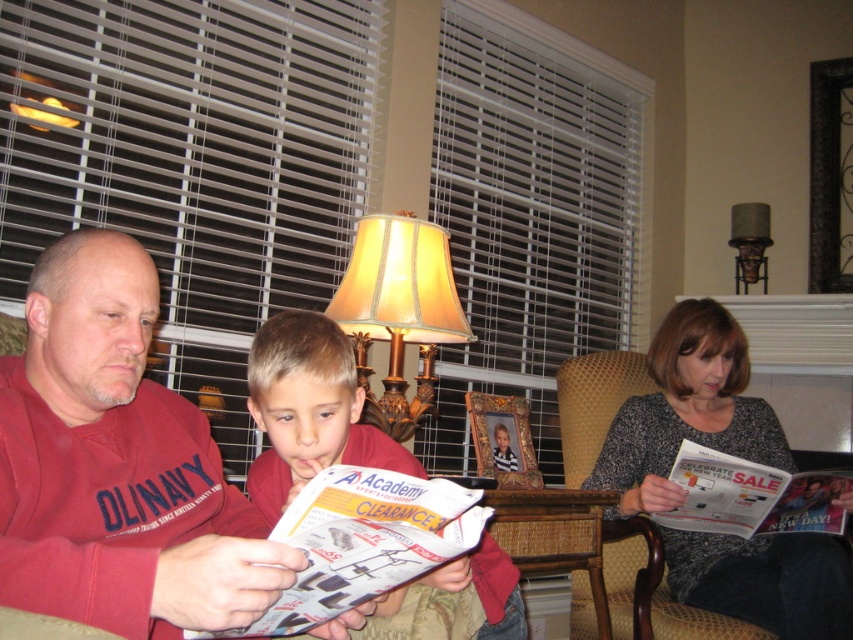
You are a photographer setting up a shot in this living room. You need to position a camera so that both the matte beige lampshade at center and the matte paper magazine at lower right are visible in the frame. Considering their heights, which object will appear taller in the photo?

The matte beige lampshade at center will appear taller in the photo because it has a greater height compared to the matte paper magazine at lower right.

You are a photographer trying to capture a clear shot of the white glossy magazine at center without the speckled gray sweater at center blocking it. Which object should you move closer to the camera to achieve this?

To capture a clear shot of the white glossy magazine at center without the speckled gray sweater at center blocking it, you should move the white glossy magazine at center closer to the camera. Since the speckled gray sweater at center is currently further away from the viewer, moving the magazine forward would place it in front of the sweater, ensuring it is visible without obstruction.